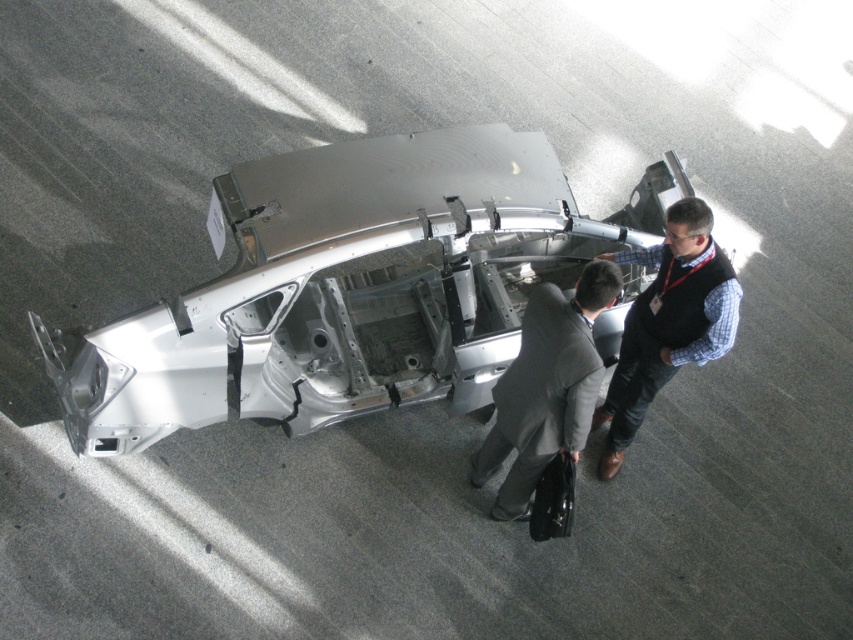
Is point (328, 173) positioned before point (502, 506)?

Yes, point (328, 173) is in front of point (502, 506).

In the scene shown: Which is more to the right, silver metallic car at center or dark gray suit at center?

dark gray suit at center is more to the right.

Describe the element at coordinates (347, 288) in the screenshot. I see `silver metallic car at center` at that location.

Locate an element on the screen. silver metallic car at center is located at coordinates (347, 288).

Is silver metallic car at center smaller than matte black vest at center?

Actually, silver metallic car at center might be larger than matte black vest at center.

Which is behind, point (401, 401) or point (631, 387)?

The point (401, 401) is more distant.

Between point (618, 346) and point (682, 244), which one is positioned in front?

Point (682, 244) is more forward.

You are a GUI agent. You are given a task and a screenshot of the screen. Output one action in this format:
    pyautogui.click(x=<x>, y=<y>)
    Task: Click on the silver metallic car at center
    The height and width of the screenshot is (640, 853).
    Given the screenshot: What is the action you would take?
    pyautogui.click(x=347, y=288)

Is point (585, 285) positioned in front of point (701, 253)?

Yes, it is in front of point (701, 253).

Does dark gray suit at center appear under matte black vest at center?

Yes.

Does point (581, 317) come in front of point (645, 380)?

That is True.

Where is `dark gray suit at center`? This screenshot has height=640, width=853. dark gray suit at center is located at coordinates (546, 387).